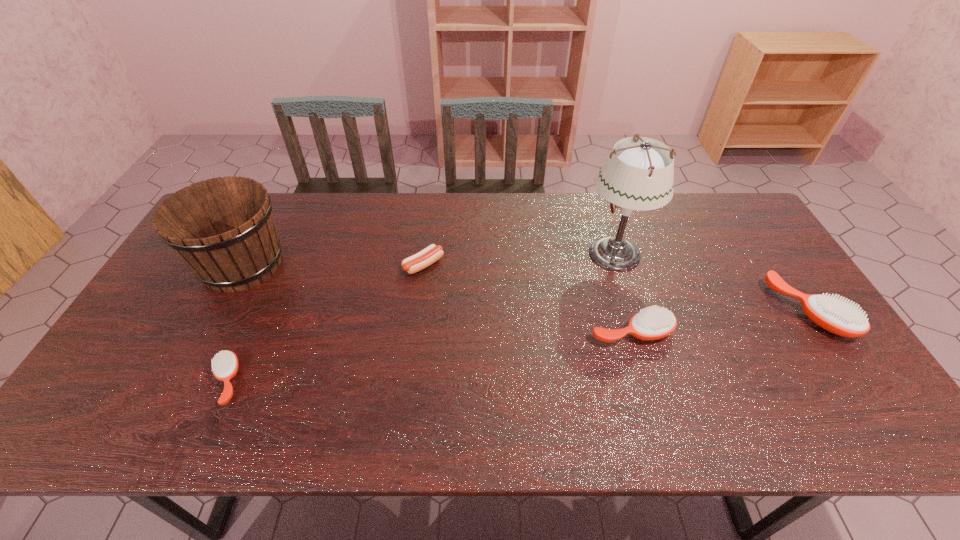
The width and height of the screenshot is (960, 540). What are the coordinates of `vacant area in the image that satisfies the following two spatial constraints: 1. on the lampshade of the rightmost object; 2. on the left side of the lampshade` in the screenshot? It's located at (632, 310).

This screenshot has height=540, width=960. I want to click on blank space that satisfies the following two spatial constraints: 1. on the back side of the rightmost hairbrush; 2. on the right side of the second tallest hairbrush, so click(625, 310).

Locate an element on the screen. The width and height of the screenshot is (960, 540). vacant point that satisfies the following two spatial constraints: 1. on the back side of the leftmost hairbrush; 2. on the left side of the second hairbrush from right to left is located at coordinates (249, 332).

Identify the location of blank area in the image that satisfies the following two spatial constraints: 1. on the back side of the fourth object from right to left; 2. on the left side of the nearest hairbrush. The image size is (960, 540). (278, 265).

At what (x,y) coordinates should I click in order to perform the action: click on vacant space that satisfies the following two spatial constraints: 1. on the front side of the fourth object from right to left; 2. on the right side of the second hairbrush from left to right. Please return your answer as a coordinate pair (x, y). Looking at the image, I should click on (416, 332).